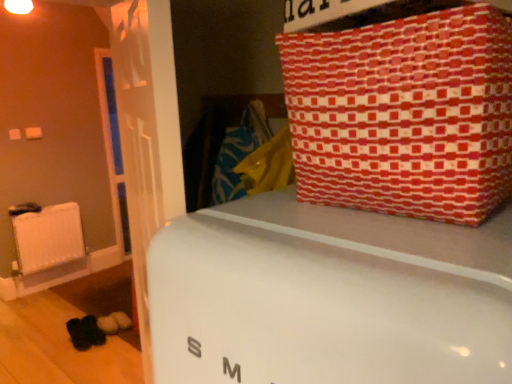
Question: From the image's perspective, is white matte radiator at left positioned above or below white glossy refrigerator at center?

Choices:
 (A) below
 (B) above

Answer: (A)

Question: In the image, is white matte radiator at left on the left side or the right side of white glossy refrigerator at center?

Choices:
 (A) left
 (B) right

Answer: (A)

Question: Estimate the real-world distances between objects in this image. Which object is closer to the white matte radiator at left?

Choices:
 (A) white glossy refrigerator at center
 (B) red patterned fabric at upper right

Answer: (A)

Question: Estimate the real-world distances between objects in this image. Which object is farther from the white matte radiator at left?

Choices:
 (A) white glossy refrigerator at center
 (B) red patterned fabric at upper right

Answer: (B)